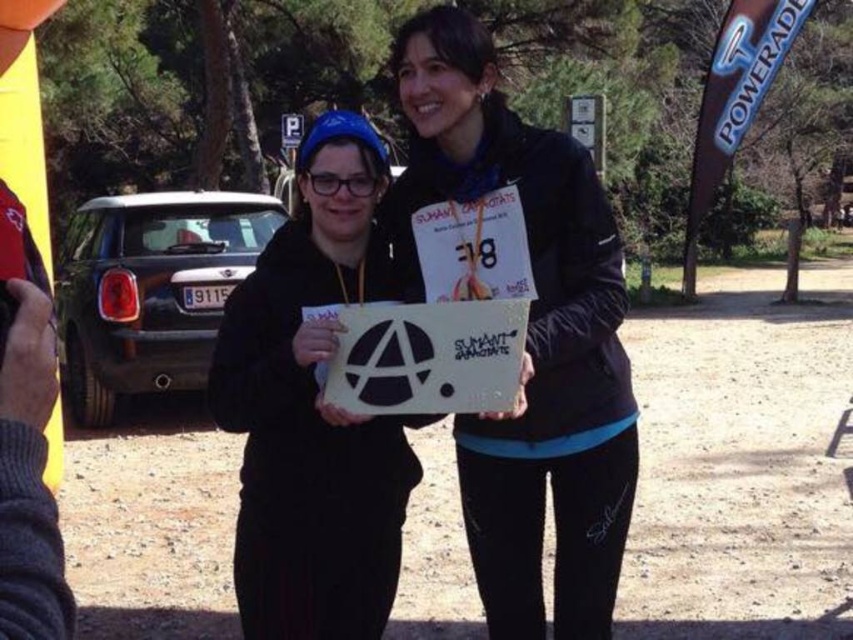
You are a photographer trying to capture both the black matte jacket at center and the white matte sign at center in a single shot. Based on their positions, which object should you adjust your camera to focus on first to ensure both are in frame?

The black matte jacket at center is to the right of the white matte sign at center, so focus on the white matte sign at center first to ensure both are in frame.

You are a photographer at the event and need to ensure the signs are visible in the photo. Which clothing item, the black matte jacket at center or the black matte hoodie at center, is positioned higher and thus less likely to block the signs?

The black matte jacket at center is located above the black matte hoodie at center, so it is positioned higher and less likely to block the signs.

You are a photographer at the event and need to position two models holding signs. The models are wearing the black matte jacket at center and the black matte hoodie at center. To ensure both signs are at eye level for a photo, which model should stand on a platform to compensate for their height difference?

The black matte hoodie at center should stand on a platform because the black matte jacket at center is taller, so raising the shorter model will align their eye levels.